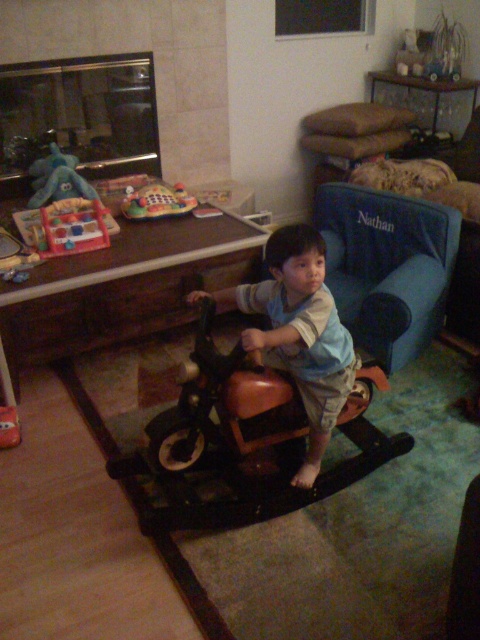
Question: Which point appears closest to the camera in this image?

Choices:
 (A) (188, 195)
 (B) (27, 204)

Answer: (B)

Question: Which point is closer to the camera taking this photo?

Choices:
 (A) [129, 196]
 (B) [300, 285]
 (C) [40, 202]

Answer: (B)

Question: Estimate the real-world distances between objects in this image. Which object is closer to the blue plush elephant at upper left?

Choices:
 (A) brown leather motorcycle at center
 (B) plastic colorful play mat at center

Answer: (B)

Question: Is brown leather motorcycle at center positioned before plastic colorful play mat at center?

Choices:
 (A) no
 (B) yes

Answer: (B)

Question: Is brown leather motorcycle at center behind blue plush elephant at upper left?

Choices:
 (A) no
 (B) yes

Answer: (A)

Question: Can you confirm if brown leather motorcycle at center is positioned to the left of plastic colorful play mat at center?

Choices:
 (A) no
 (B) yes

Answer: (A)